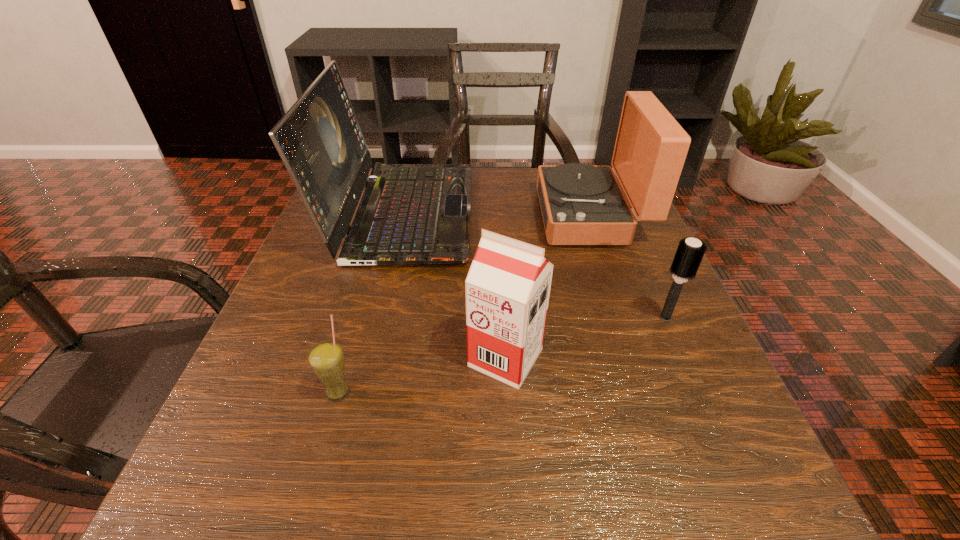
You are a GUI agent. You are given a task and a screenshot of the screen. Output one action in this format:
    pyautogui.click(x=<x>, y=<y>)
    Task: Click on the vacant space that satisfies the following two spatial constraints: 1. on the screen of the laptop computer; 2. on the left side of the soya milk
    This screenshot has width=960, height=540.
    Given the screenshot: What is the action you would take?
    pyautogui.click(x=368, y=357)